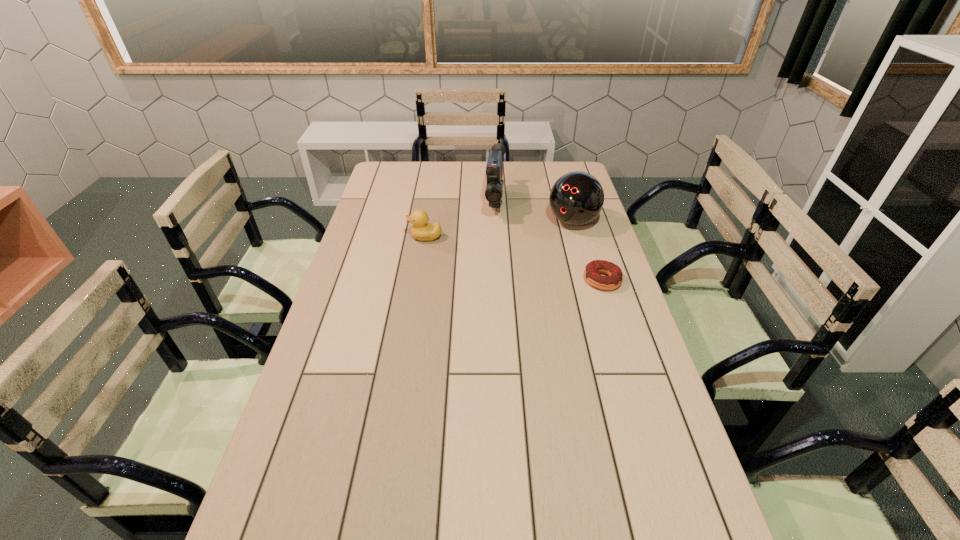
Where is `free region located 0.060m on the surface of the bowling ball near the finger holes`? The height and width of the screenshot is (540, 960). free region located 0.060m on the surface of the bowling ball near the finger holes is located at coordinates (552, 241).

Identify the location of blank space located 0.210m on the surface of the bowling ball near the finger holes. The height and width of the screenshot is (540, 960). (530, 261).

Locate an element on the screen. This screenshot has height=540, width=960. free region located on the surface of the bowling ball near the finger holes is located at coordinates (511, 280).

Identify the location of vacant space located on the front-facing side of the second object from left to right. [493, 273].

Image resolution: width=960 pixels, height=540 pixels. Find the location of `free space located on the front-facing side of the second object from left to right`. free space located on the front-facing side of the second object from left to right is located at coordinates (495, 239).

This screenshot has height=540, width=960. I want to click on free space located 0.350m on the front-facing side of the second object from left to right, so click(493, 285).

Image resolution: width=960 pixels, height=540 pixels. I want to click on object that is at the far edge, so click(494, 170).

At what (x,y) coordinates should I click in order to perform the action: click on doughnut that is at the right edge. Please return your answer as a coordinate pair (x, y). The width and height of the screenshot is (960, 540). Looking at the image, I should click on (591, 273).

Find the location of a particular element. The image size is (960, 540). bowling ball at the right edge is located at coordinates (576, 198).

In the image, there is a desktop. At what (x,y) coordinates should I click in order to perform the action: click on vacant space at the far edge. Please return your answer as a coordinate pair (x, y). The image size is (960, 540). Looking at the image, I should click on (413, 183).